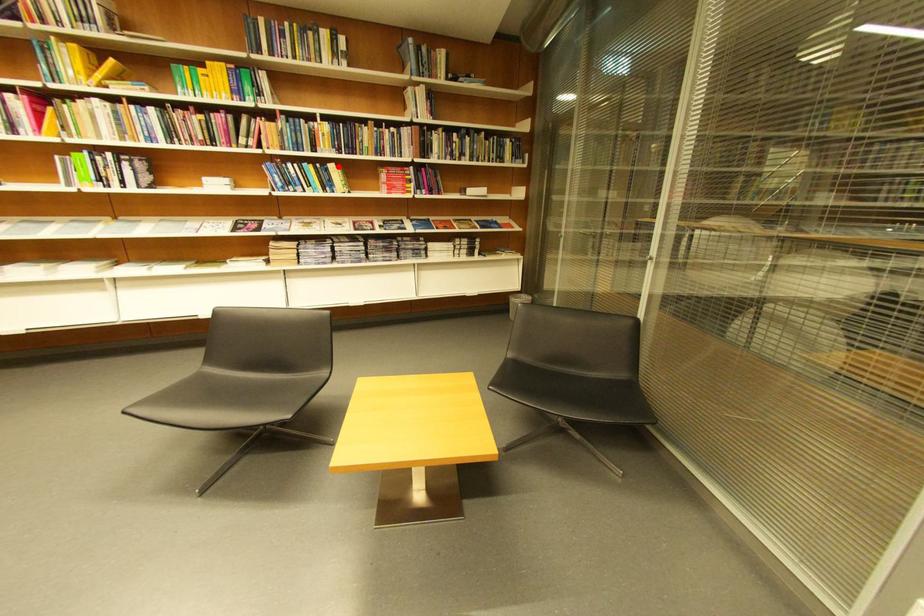
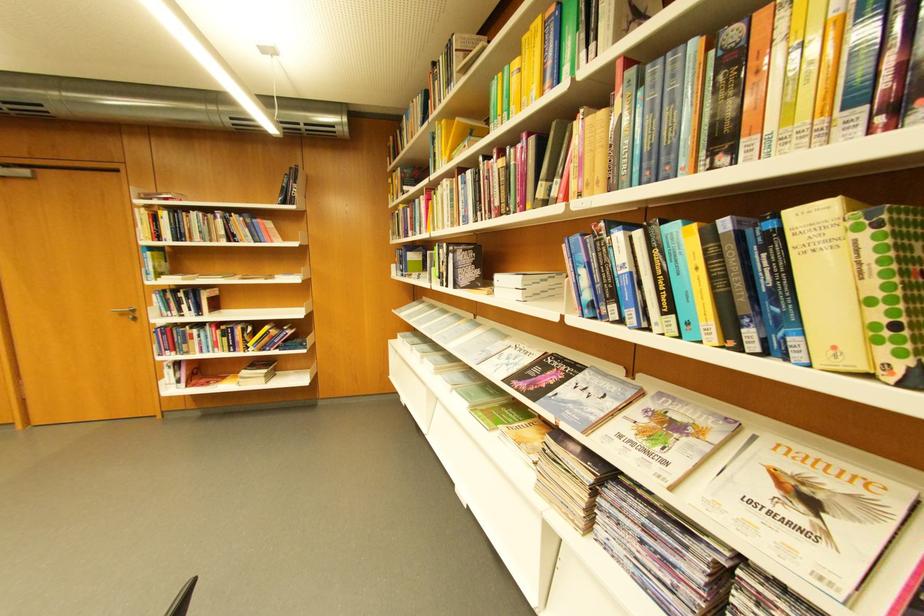
Where in the second image is the point corresponding to the highlighted location from the first image?

(796, 214)